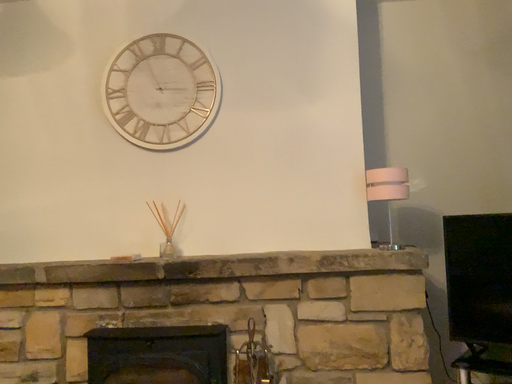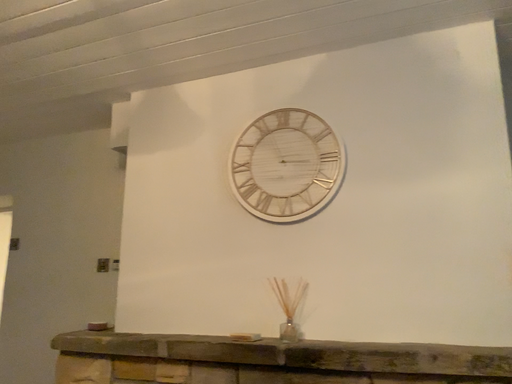
Question: Which way did the camera rotate in the video?

Choices:
 (A) rotated right
 (B) rotated left

Answer: (B)